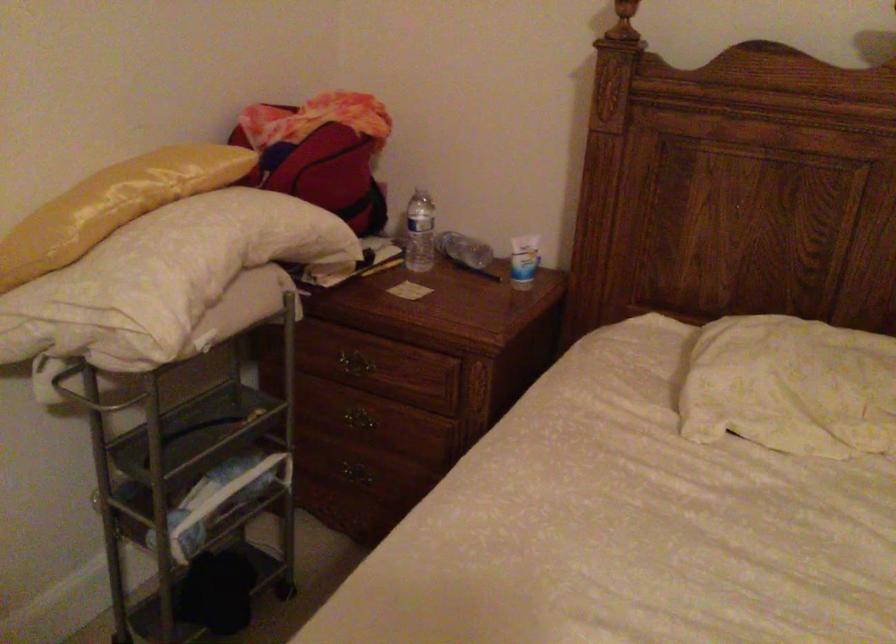
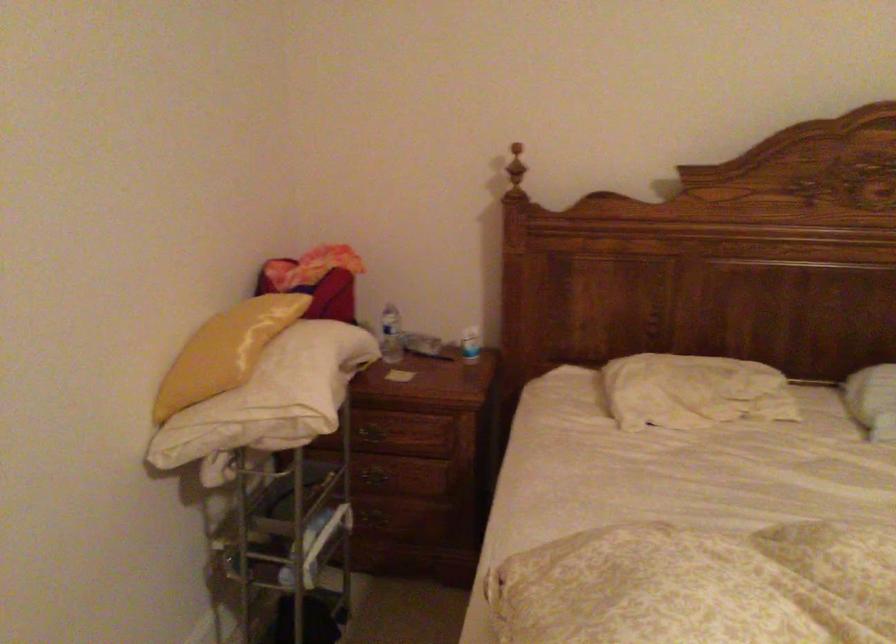
Find the pixel in the second image that matches pixel 410 231 in the first image.

(391, 335)